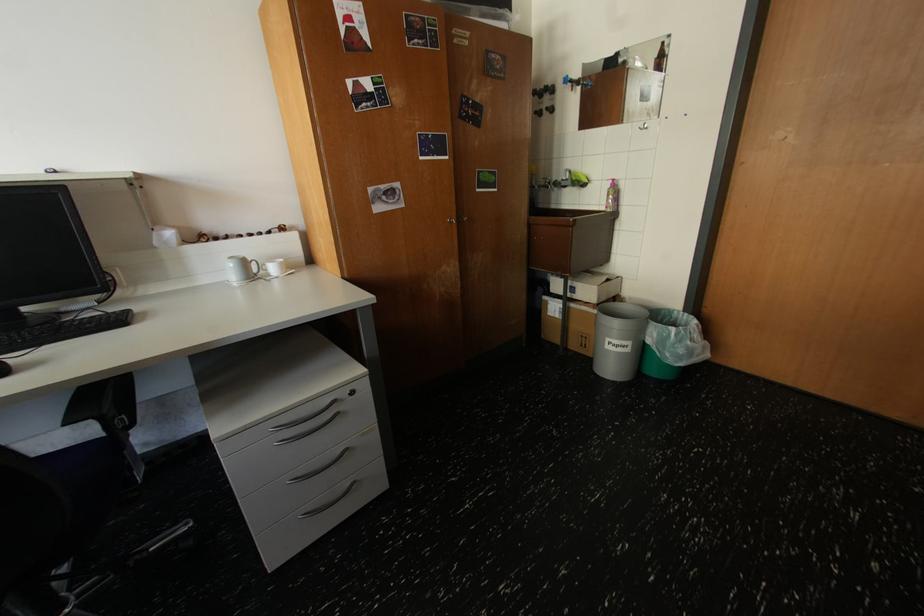
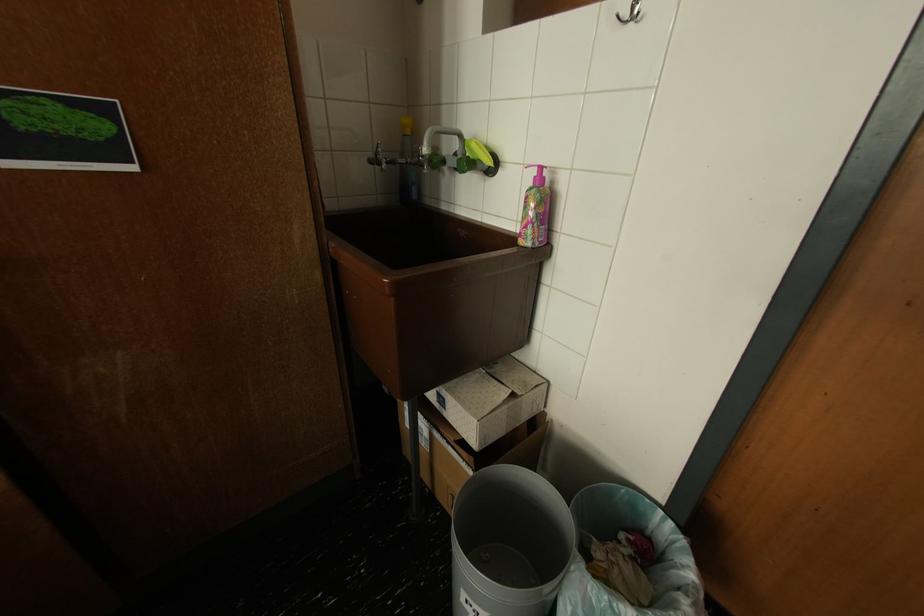
The point at (613, 281) is marked in the first image. Where is the corresponding point in the second image?

(508, 402)